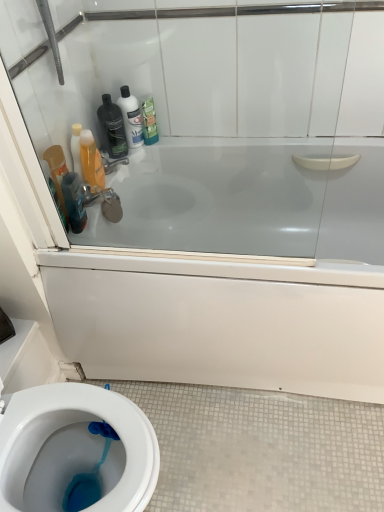
Question: Considering the relative positions of translucent plastic mouthwash at left, which is the 2th mouthwash in left-to-right order, and translucent plastic mouthwash at left, acting as the second mouthwash starting from the right, in the image provided, is translucent plastic mouthwash at left, which is the 2th mouthwash in left-to-right order, to the left of translucent plastic mouthwash at left, acting as the second mouthwash starting from the right, from the viewer's perspective?

Choices:
 (A) yes
 (B) no

Answer: (B)

Question: From the image's perspective, is translucent plastic mouthwash at left, positioned as the first mouthwash in right-to-left order, on translucent plastic mouthwash at left, acting as the first mouthwash starting from the left?

Choices:
 (A) no
 (B) yes

Answer: (A)

Question: Considering the relative sizes of translucent plastic mouthwash at left, which is the 2th mouthwash in left-to-right order, and translucent plastic mouthwash at left, acting as the first mouthwash starting from the left, in the image provided, is translucent plastic mouthwash at left, which is the 2th mouthwash in left-to-right order, wider than translucent plastic mouthwash at left, acting as the first mouthwash starting from the left,?

Choices:
 (A) yes
 (B) no

Answer: (B)

Question: Is translucent plastic mouthwash at left, which is the 2th mouthwash in left-to-right order, with translucent plastic mouthwash at left, acting as the first mouthwash starting from the left?

Choices:
 (A) yes
 (B) no

Answer: (A)

Question: Would you say translucent plastic mouthwash at left, which is the 2th mouthwash in left-to-right order, is a long distance from translucent plastic mouthwash at left, acting as the first mouthwash starting from the left?

Choices:
 (A) no
 (B) yes

Answer: (A)

Question: Is translucent plastic mouthwash at left, positioned as the first mouthwash in right-to-left order, looking in the opposite direction of translucent plastic mouthwash at left, acting as the first mouthwash starting from the left?

Choices:
 (A) no
 (B) yes

Answer: (B)

Question: Considering the relative sizes of white glossy bathtub at upper center and translucent plastic bottle at upper center, arranged as the 2th cleaning product when viewed from the left, in the image provided, is white glossy bathtub at upper center bigger than translucent plastic bottle at upper center, arranged as the 2th cleaning product when viewed from the left,?

Choices:
 (A) yes
 (B) no

Answer: (A)

Question: Does white glossy bathtub at upper center appear on the left side of translucent plastic bottle at upper center, the second cleaning product from the right?

Choices:
 (A) no
 (B) yes

Answer: (A)

Question: Does white glossy bathtub at upper center have a greater width compared to translucent plastic bottle at upper center, the second cleaning product from the right?

Choices:
 (A) no
 (B) yes

Answer: (B)

Question: Are white glossy bathtub at upper center and translucent plastic bottle at upper center, the second cleaning product from the right, making contact?

Choices:
 (A) yes
 (B) no

Answer: (B)

Question: Is white glossy bathtub at upper center further to camera compared to translucent plastic bottle at upper center, arranged as the 2th cleaning product when viewed from the left?

Choices:
 (A) yes
 (B) no

Answer: (B)

Question: Considering the relative sizes of white glossy bathtub at upper center and translucent plastic bottle at upper center, the second cleaning product from the right, in the image provided, is white glossy bathtub at upper center smaller than translucent plastic bottle at upper center, the second cleaning product from the right,?

Choices:
 (A) no
 (B) yes

Answer: (A)

Question: Is matte black bottle at upper left oriented away from transparent glass door at upper center?

Choices:
 (A) no
 (B) yes

Answer: (A)